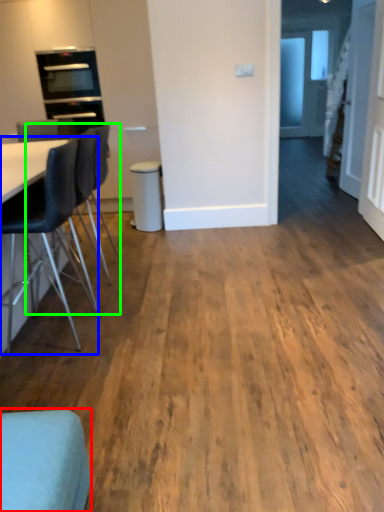
Question: Which is farther away from chair (highlighted by a red box)? chair (highlighted by a blue box) or chair (highlighted by a green box)?

Choices:
 (A) chair
 (B) chair

Answer: (B)